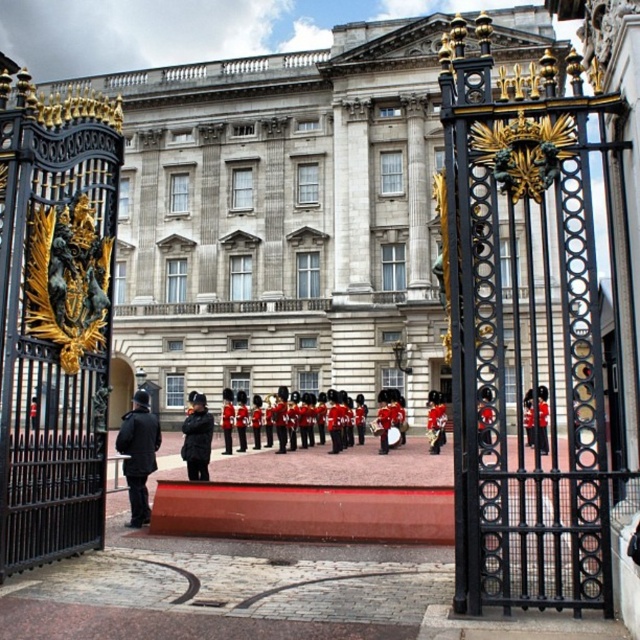
From the picture: You are a guest attending a royal event and see the black matte uniform at center and the black matte jacket at center. Which one is closer to the ground?

The black matte uniform at center is positioned under the black matte jacket at center, so it is closer to the ground.

In the scene shown: You are standing at the entrance of Buckingham Palace and see the point at coordinates (280, 220). Based on the scene description, where exactly is this point located?

The point at coordinates (280, 220) is located on the white stone building at center, which is the main structure of Buckingham Palace.